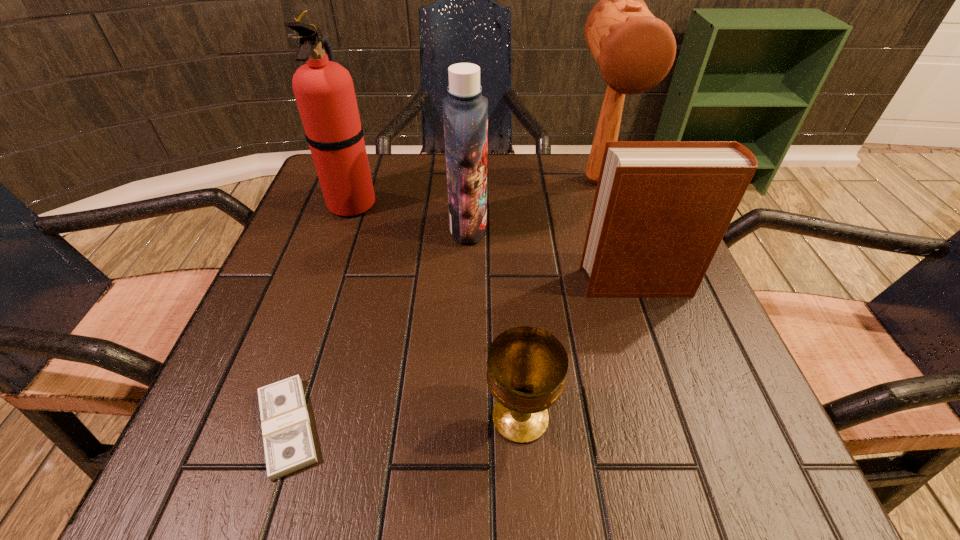
The image size is (960, 540). Identify the location of vacant space that is in between the chalice and the fire extinguisher. (437, 310).

Where is `free space between the third nearest object and the shampoo`? Image resolution: width=960 pixels, height=540 pixels. free space between the third nearest object and the shampoo is located at coordinates (x=553, y=255).

Image resolution: width=960 pixels, height=540 pixels. Find the location of `free space between the chalice and the dollar`. free space between the chalice and the dollar is located at coordinates (404, 422).

Image resolution: width=960 pixels, height=540 pixels. In order to click on unoccupied area between the chalice and the shampoo in this screenshot , I will do `click(494, 322)`.

At what (x,y) coordinates should I click in order to perform the action: click on object that ranks as the third closest to the second shortest object. Please return your answer as a coordinate pair (x, y). Image resolution: width=960 pixels, height=540 pixels. Looking at the image, I should click on (465, 111).

Identify the location of object that is the third closest one to the chalice. (465, 111).

The height and width of the screenshot is (540, 960). Identify the location of vacant space that satisfies the following two spatial constraints: 1. on the strike surface of the mallet; 2. on the front label of the fourth shortest object. [612, 227].

At what (x,y) coordinates should I click in order to perform the action: click on vacant space that satisfies the following two spatial constraints: 1. on the strike surface of the mallet; 2. on the front label of the shampoo. Please return your answer as a coordinate pair (x, y). Looking at the image, I should click on (612, 227).

The width and height of the screenshot is (960, 540). In order to click on free point that satisfies the following two spatial constraints: 1. at the nozzle of the shortest object; 2. on the right side of the fire extinguisher in this screenshot , I will do `click(275, 427)`.

I want to click on free region that satisfies the following two spatial constraints: 1. on the back side of the chalice; 2. on the front label of the shampoo, so click(507, 227).